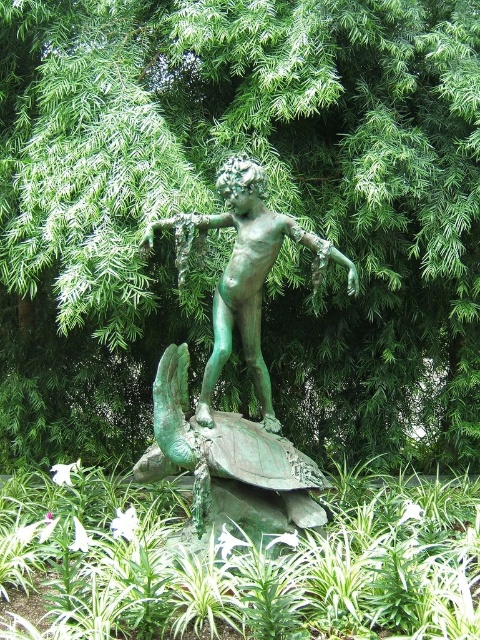
You are an art student analyzing the statue in the image. You notice two descriptions of the statue as either a green textured statue at center or a green patina statue at center. Based on the scene description, which one is larger?

The green textured statue at center is bigger than the green patina statue at center.

You are standing in front of the bronze statue and want to know which of the two points, point (470, 259) or point (421, 584), is closer to you. Can you determine this based on their positions?

Point (470, 259) is further to the viewer than point (421, 584), so point (421, 584) is closer to you.

You are a park visitor who wants to take a photo of the green patina statue at center and the green patina tortoise at center. Which one should you focus on first if you want to capture both in the same frame without moving your camera?

You should focus on the green patina statue at center first because it is above the green patina tortoise at center, so adjusting focus from top to bottom will help capture both in the frame.